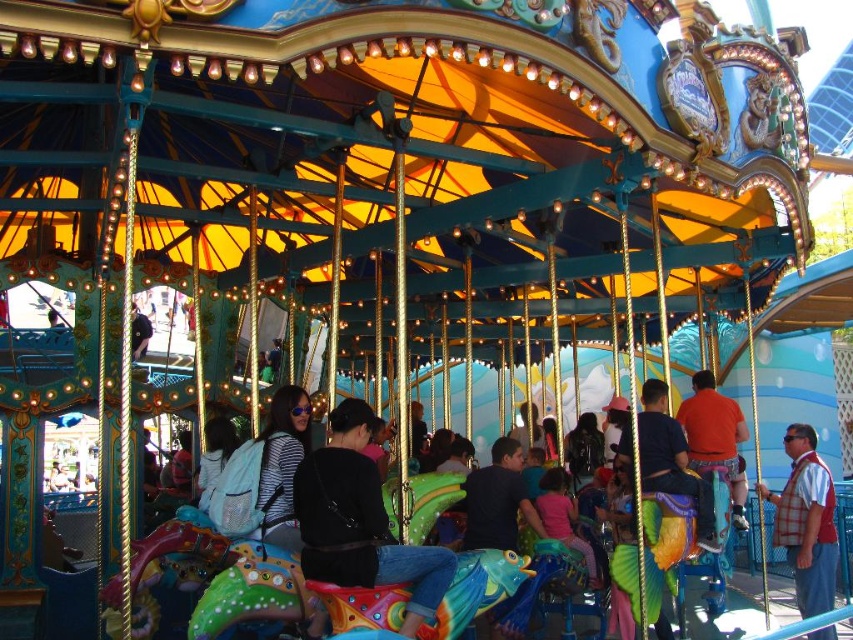
Question: Can you confirm if black matte jacket at center is positioned to the left of plaid fabric vest at lower right?

Choices:
 (A) no
 (B) yes

Answer: (B)

Question: Does plaid fabric vest at lower right come behind pink fabric at center?

Choices:
 (A) no
 (B) yes

Answer: (A)

Question: Observing the image, what is the correct spatial positioning of orange matte shirt at center in reference to pink fabric at center?

Choices:
 (A) above
 (B) below

Answer: (A)

Question: Among these points, which one is nearest to the camera?

Choices:
 (A) (553, 518)
 (B) (314, 552)

Answer: (B)

Question: Which of the following is the farthest from the observer?

Choices:
 (A) (821, 484)
 (B) (589, 566)
 (C) (369, 467)
 (D) (709, 372)

Answer: (D)

Question: Which object is closer to the camera taking this photo?

Choices:
 (A) pink fabric at center
 (B) plaid fabric vest at lower right
 (C) orange matte shirt at center

Answer: (B)